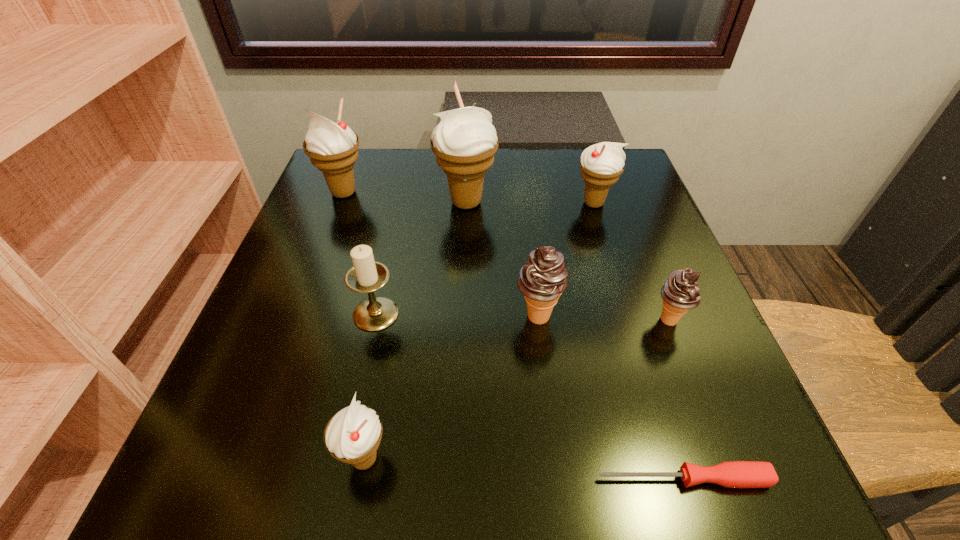
Identify the location of free space between the fourth object from right to left and the second tallest icecream. (441, 254).

Locate an element on the screen. The width and height of the screenshot is (960, 540). free space that is in between the fifth object from left to right and the tallest object is located at coordinates (502, 259).

The width and height of the screenshot is (960, 540). Find the location of `free spot between the screwdriver and the seventh shortest object`. free spot between the screwdriver and the seventh shortest object is located at coordinates (514, 336).

Identify the location of free point between the shortest object and the nearest white icecream. Image resolution: width=960 pixels, height=540 pixels. (524, 469).

The width and height of the screenshot is (960, 540). I want to click on empty location between the right chocolate icecream and the fifth object from left to right, so 603,318.

Locate an element on the screen. free space between the fourth object from right to left and the tallest object is located at coordinates (502, 259).

At what (x,y) coordinates should I click in order to perform the action: click on vacant space in between the right chocolate icecream and the leftmost object. Please return your answer as a coordinate pair (x, y). The width and height of the screenshot is (960, 540). Looking at the image, I should click on (506, 256).

Locate an element on the screen. object that ranks as the closest to the white candle holder is located at coordinates (352, 435).

Choose which object is the second nearest neighbor to the second white icecream from right to left. Please provide its 2D coordinates. Your answer should be formatted as a tuple, i.e. [(x, y)], where the tuple contains the x and y coordinates of a point satisfying the conditions above.

[(601, 164)]

Locate which icecream is the closest to the nearest icecream. Please provide its 2D coordinates. Your answer should be formatted as a tuple, i.e. [(x, y)], where the tuple contains the x and y coordinates of a point satisfying the conditions above.

[(542, 279)]